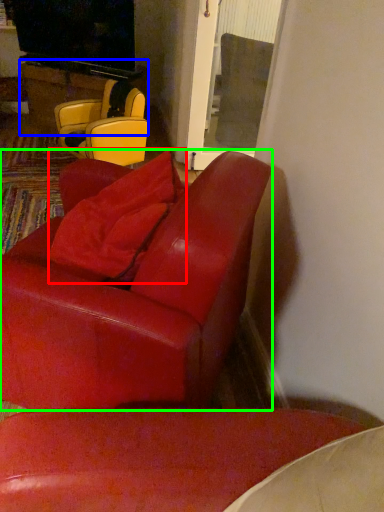
Question: Based on their relative distances, which object is farther from pillow (highlighted by a red box)? Choose from table (highlighted by a blue box) and chair (highlighted by a green box).

Choices:
 (A) table
 (B) chair

Answer: (A)